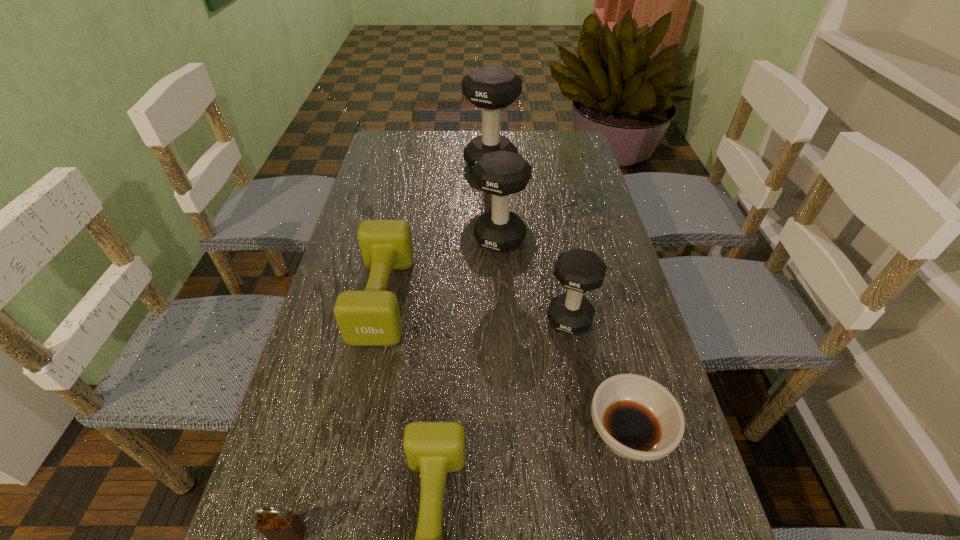
At what (x,y) coordinates should I click in order to perform the action: click on the tallest dumbbell. Please return your answer as a coordinate pair (x, y). Image resolution: width=960 pixels, height=540 pixels. Looking at the image, I should click on (491, 88).

At what (x,y) coordinates should I click in order to perform the action: click on the farthest object. Please return your answer as a coordinate pair (x, y). Looking at the image, I should click on point(491,88).

This screenshot has height=540, width=960. What are the coordinates of `the fourth nearest dumbbell` in the screenshot? It's located at (501, 173).

The width and height of the screenshot is (960, 540). I want to click on the sixth nearest object, so click(x=501, y=173).

Identify the location of the rightmost gray dumbbell. The image size is (960, 540). (578, 270).

I want to click on the nearest gray dumbbell, so click(x=578, y=270).

Where is `the leftmost dumbbell`? The height and width of the screenshot is (540, 960). the leftmost dumbbell is located at coordinates (371, 317).

Locate an element on the screen. the bigger olive dumbbell is located at coordinates (371, 317).

The image size is (960, 540). What are the coordinates of `soup bowl` in the screenshot? It's located at (637, 418).

The image size is (960, 540). I want to click on vacant space located 0.050m on the right of the farthest object, so click(x=532, y=164).